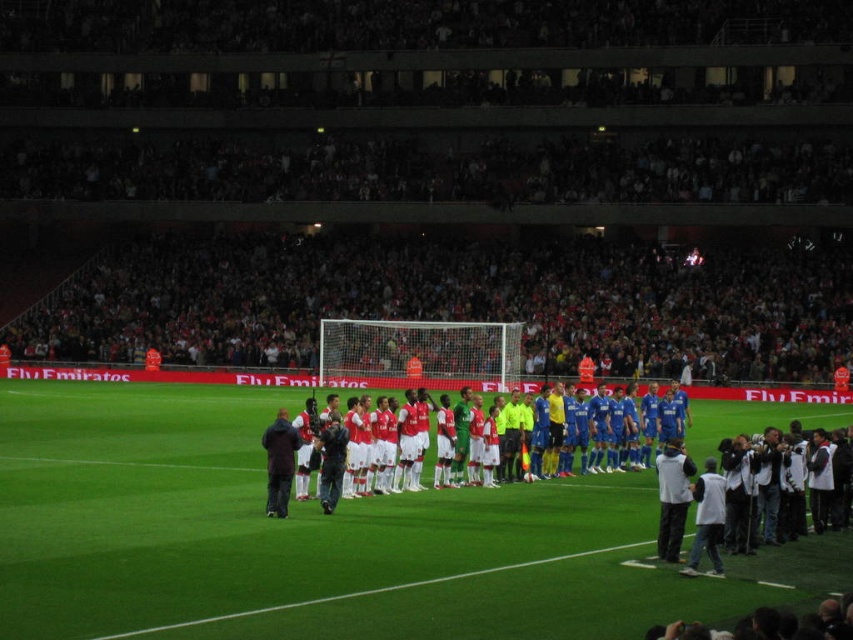
Does point (769, 358) lie in front of point (357, 451)?

No, it is behind (357, 451).

Can you confirm if dark red fabric crowd at upper center is positioned to the right of white smooth soccer team at center?

No, dark red fabric crowd at upper center is not to the right of white smooth soccer team at center.

Is point (83, 288) in front of point (572, 416)?

No.

Where is `dark red fabric crowd at upper center`? The height and width of the screenshot is (640, 853). dark red fabric crowd at upper center is located at coordinates (457, 301).

Can you confirm if dark red fabric crowd at upper center is positioned below white fabric jacket at center?

Incorrect, dark red fabric crowd at upper center is not positioned below white fabric jacket at center.

Does point (751, 332) lie behind point (672, 502)?

Yes.

Image resolution: width=853 pixels, height=640 pixels. In order to click on dark red fabric crowd at upper center in this screenshot , I will do `click(457, 301)`.

Between white smooth soccer team at center and dark blue jacket at center, which one is positioned lower?

Positioned lower is white smooth soccer team at center.

Can you confirm if white smooth soccer team at center is positioned to the right of dark blue jacket at center?

Yes, white smooth soccer team at center is to the right of dark blue jacket at center.

Between point (416, 416) and point (294, 436), which one is positioned in front?

Point (294, 436) is more forward.

The image size is (853, 640). What are the coordinates of `white smooth soccer team at center` in the screenshot? It's located at (375, 435).